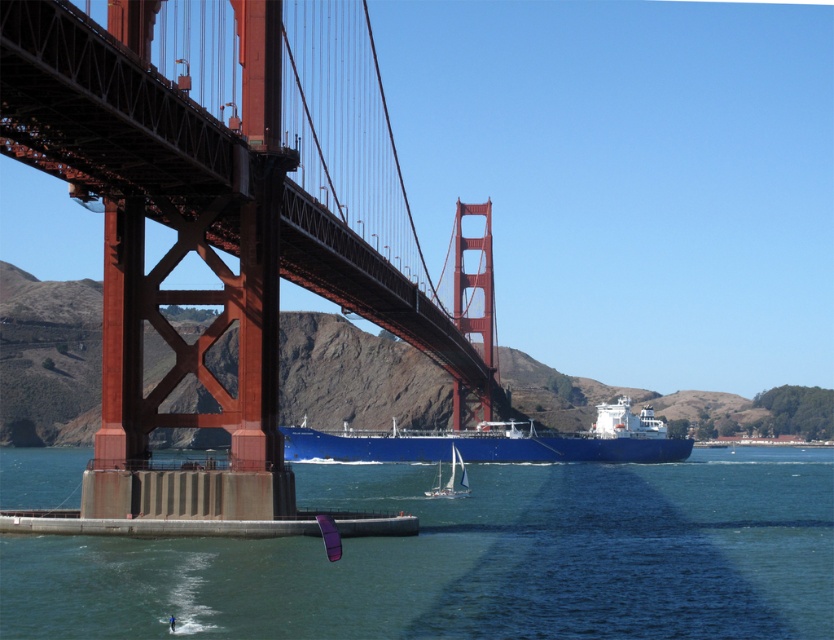
Which is below, blue matte ship at center or white sailboat at center?

white sailboat at center

Who is positioned more to the left, blue matte ship at center or white sailboat at center?

From the viewer's perspective, white sailboat at center appears more on the left side.

Is point (295, 442) closer to camera compared to point (438, 493)?

No, (295, 442) is behind (438, 493).

The width and height of the screenshot is (834, 640). What are the coordinates of `blue matte ship at center` in the screenshot? It's located at (500, 442).

Is blue water at lower center in front of white sailboat at center?

That is True.

How far apart are blue water at lower center and white sailboat at center?

25.56 meters

This screenshot has height=640, width=834. What do you see at coordinates (473, 560) in the screenshot? I see `blue water at lower center` at bounding box center [473, 560].

This screenshot has width=834, height=640. Find the location of `blue water at lower center`. blue water at lower center is located at coordinates (473, 560).

Is point (144, 24) closer to viewer compared to point (440, 486)?

Yes, it is.

Measure the distance between red steel suspension bridge at center and camera.

red steel suspension bridge at center and camera are 141.87 feet apart from each other.

Image resolution: width=834 pixels, height=640 pixels. Identify the location of red steel suspension bridge at center. (196, 243).